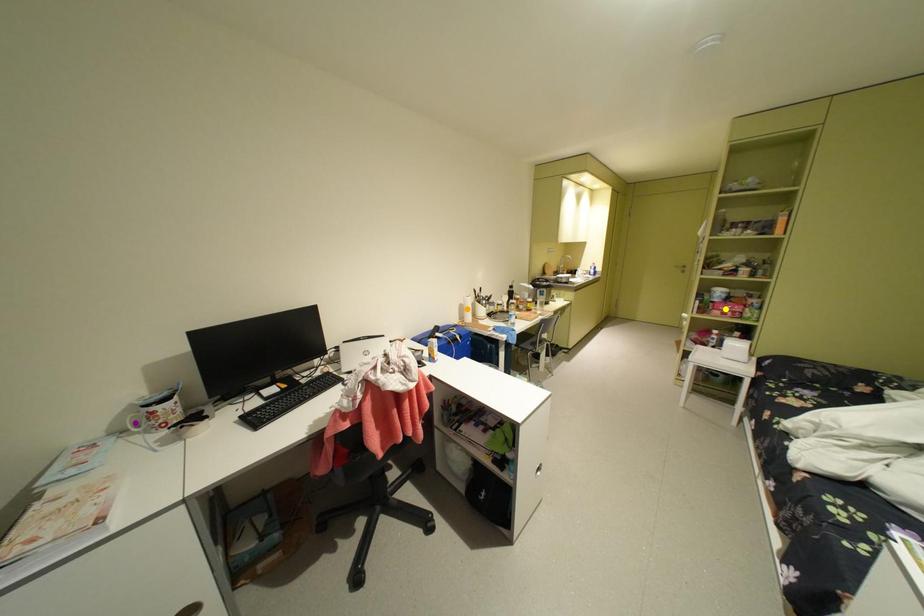
Order these from nearest to farthest:
yellow point
purple point
orange point

1. purple point
2. yellow point
3. orange point